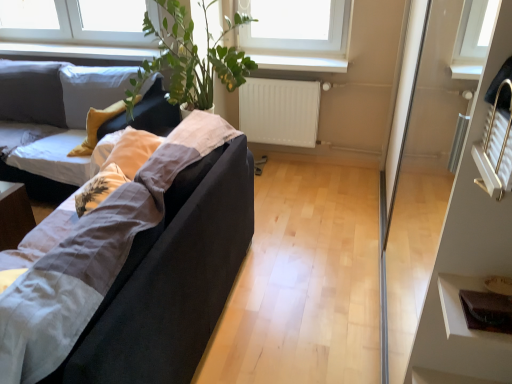
Question: Considering the relative positions of transparent glass door at right and white matte radiator at center in the image provided, is transparent glass door at right to the left of white matte radiator at center from the viewer's perspective?

Choices:
 (A) no
 (B) yes

Answer: (A)

Question: Is transparent glass door at right aimed at white matte radiator at center?

Choices:
 (A) no
 (B) yes

Answer: (A)

Question: Considering the relative sizes of transparent glass door at right and white matte radiator at center in the image provided, is transparent glass door at right shorter than white matte radiator at center?

Choices:
 (A) yes
 (B) no

Answer: (B)

Question: From a real-world perspective, is transparent glass door at right located higher than white matte radiator at center?

Choices:
 (A) yes
 (B) no

Answer: (A)

Question: Would you say white matte radiator at center is part of transparent glass door at right's contents?

Choices:
 (A) no
 (B) yes

Answer: (A)

Question: Is transparent glass door at right not close to white matte radiator at center?

Choices:
 (A) yes
 (B) no

Answer: (B)

Question: From the image's perspective, would you say transparent glass door at right is shown under matte black couch at left, marked as the first studio couch in a back-to-front arrangement?

Choices:
 (A) yes
 (B) no

Answer: (A)

Question: Is transparent glass door at right turned away from matte black couch at left, marked as the first studio couch in a back-to-front arrangement?

Choices:
 (A) no
 (B) yes

Answer: (A)

Question: Does transparent glass door at right have a greater height compared to matte black couch at left, marked as the first studio couch in a back-to-front arrangement?

Choices:
 (A) no
 (B) yes

Answer: (B)

Question: Is transparent glass door at right not close to matte black couch at left, the 2th studio couch when ordered from front to back?

Choices:
 (A) yes
 (B) no

Answer: (A)

Question: Can you confirm if transparent glass door at right is bigger than matte black couch at left, the 2th studio couch when ordered from front to back?

Choices:
 (A) no
 (B) yes

Answer: (A)

Question: Is transparent glass door at right to the right of matte black couch at left, marked as the first studio couch in a back-to-front arrangement, from the viewer's perspective?

Choices:
 (A) no
 (B) yes

Answer: (B)

Question: Considering the relative sizes of matte black couch at left, marked as the first studio couch in a back-to-front arrangement, and brown leather wallet at lower right in the image provided, is matte black couch at left, marked as the first studio couch in a back-to-front arrangement, taller than brown leather wallet at lower right?

Choices:
 (A) no
 (B) yes

Answer: (B)